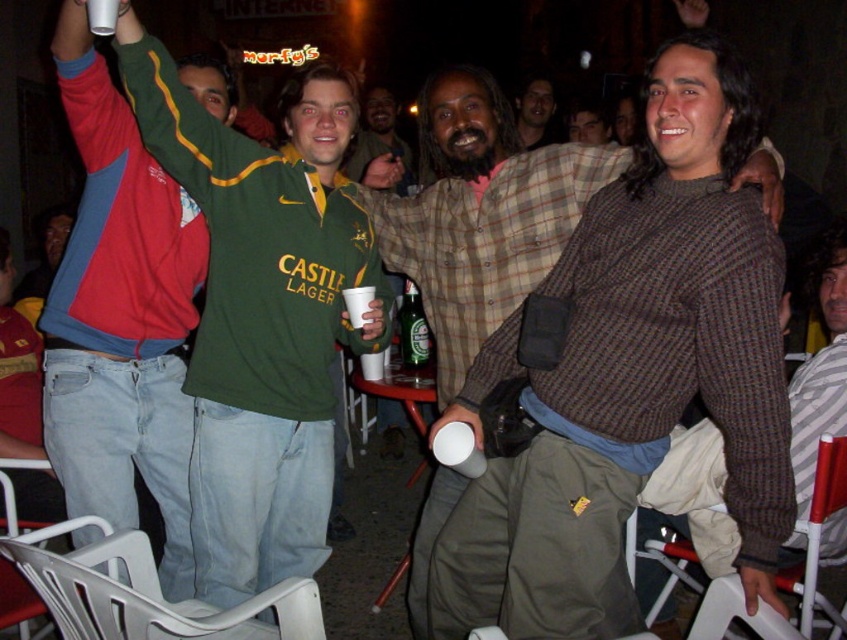
Question: Which is nearer to the brown textured sweater at center?

Choices:
 (A) matte green shirt at center
 (B) smooth brown leather jacket at center

Answer: (B)

Question: Considering the real-world distances, which object is farthest from the brown wool sweater at center?

Choices:
 (A) green jersey at center
 (B) smooth brown hair at center
 (C) matte green shirt at center
 (D) brown textured sweater at center

Answer: (C)

Question: Does brown wool sweater at center lie behind brown textured sweater at center?

Choices:
 (A) yes
 (B) no

Answer: (B)

Question: Which of the following is the closest to the observer?

Choices:
 (A) brown textured sweater at center
 (B) smooth brown leather jacket at center
 (C) smooth brown hair at center
 (D) red and blue jacket at left

Answer: (D)

Question: Can you confirm if red and blue jacket at left is positioned to the right of smooth brown leather jacket at center?

Choices:
 (A) no
 (B) yes

Answer: (A)

Question: Does green jersey at center have a lesser width compared to smooth brown leather jacket at center?

Choices:
 (A) no
 (B) yes

Answer: (A)